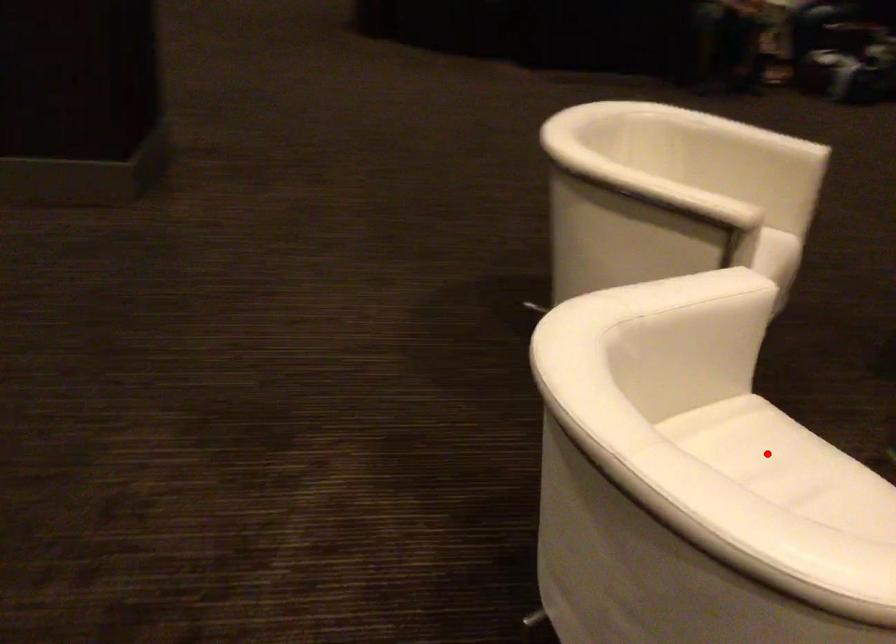
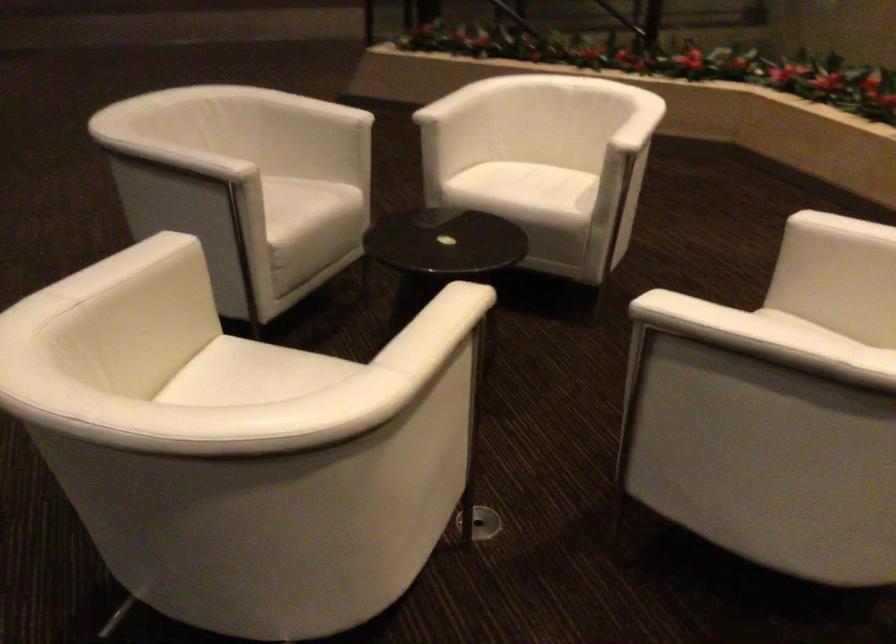
Question: I am providing you with two images of the same scene from different viewpoints. A red point is marked on the first image. Is the red point's position out of view in image 2?

Choices:
 (A) Yes
 (B) No

Answer: (A)